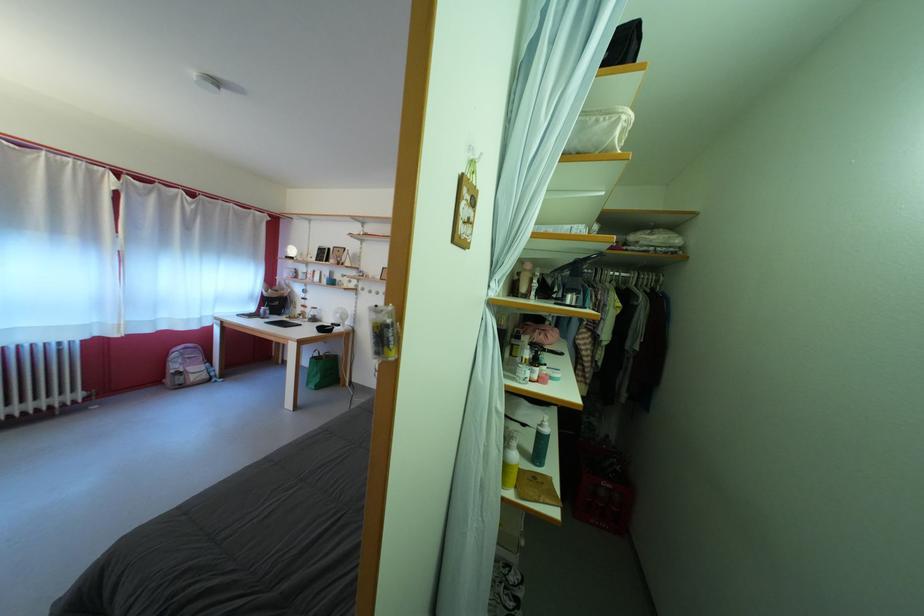
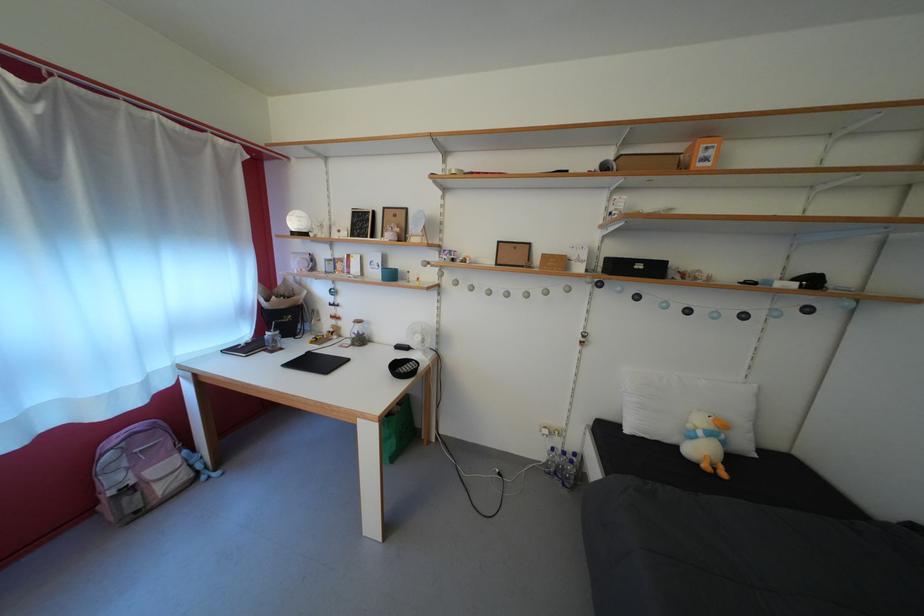
Find the pixel in the second image that matches point 333,286 in the first image.

(383, 280)